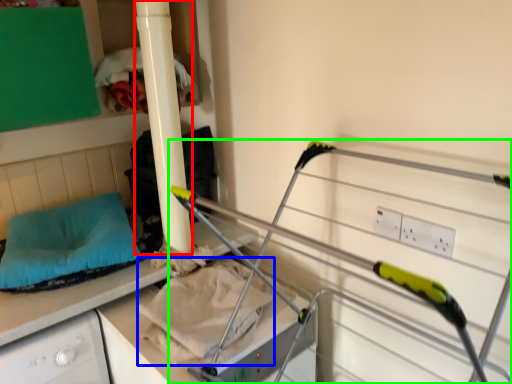
Question: Which object is positioned farthest from pillar (highlighted by a red box)? Select from sheet (highlighted by a blue box) and bunk bed (highlighted by a green box).

Choices:
 (A) sheet
 (B) bunk bed

Answer: (B)